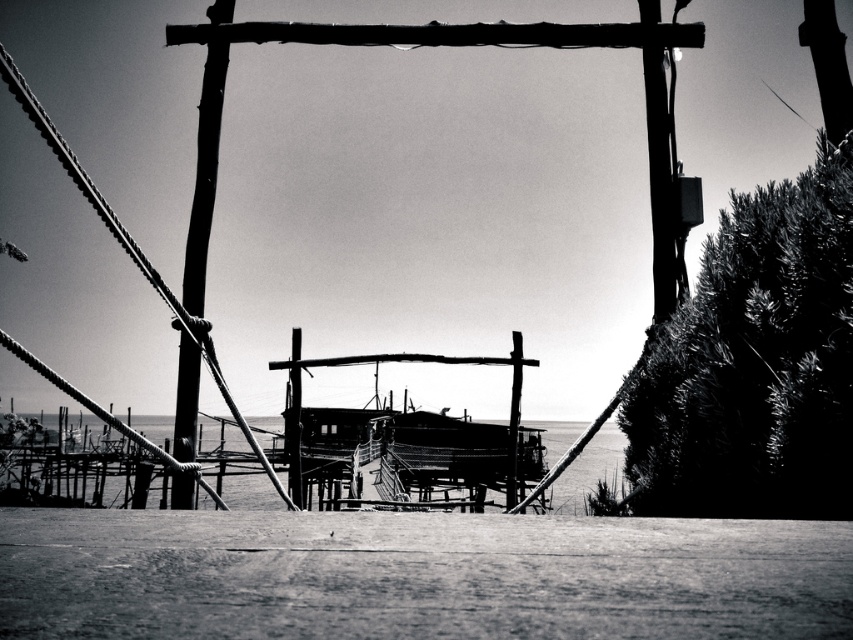
Question: Which point is farther to the camera?

Choices:
 (A) (189, 280)
 (B) (514, 445)
 (C) (334, 449)

Answer: (C)

Question: Based on their relative distances, which object is farther from the wooden telegraph pole at center?

Choices:
 (A) wooden boat at center
 (B) wooden hut at center
 (C) rustic wood telegraph pole at left

Answer: (B)

Question: Can you confirm if wooden telegraph pole at center is positioned to the right of rustic wood telegraph pole at left?

Choices:
 (A) no
 (B) yes

Answer: (B)

Question: Is rustic wood telegraph pole at left above wooden hut at center?

Choices:
 (A) yes
 (B) no

Answer: (A)

Question: Is wooden boat at center below wooden hut at center?

Choices:
 (A) no
 (B) yes

Answer: (A)

Question: Which point is farther to the camera?

Choices:
 (A) wooden boat at center
 (B) rustic wood telegraph pole at left
 (C) wooden hut at center

Answer: (C)